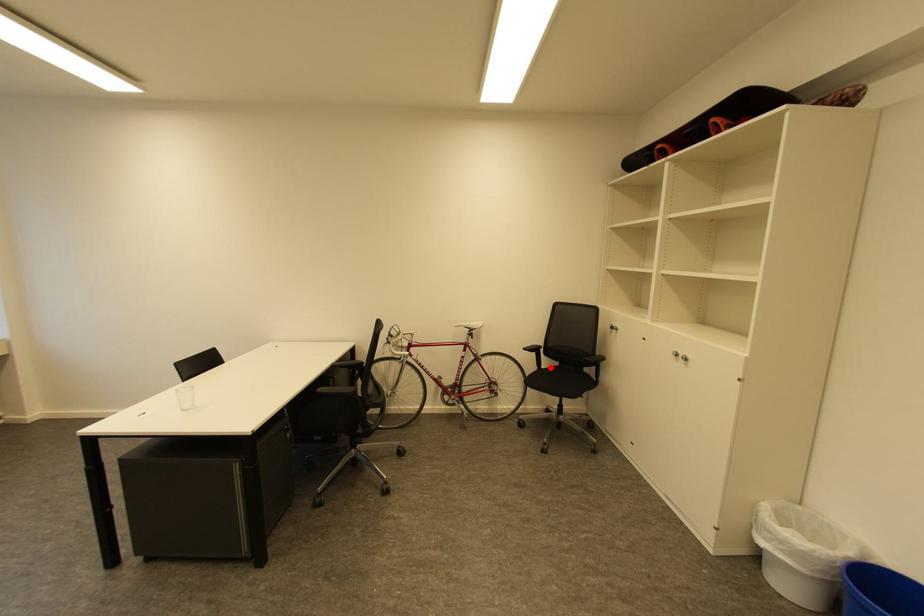
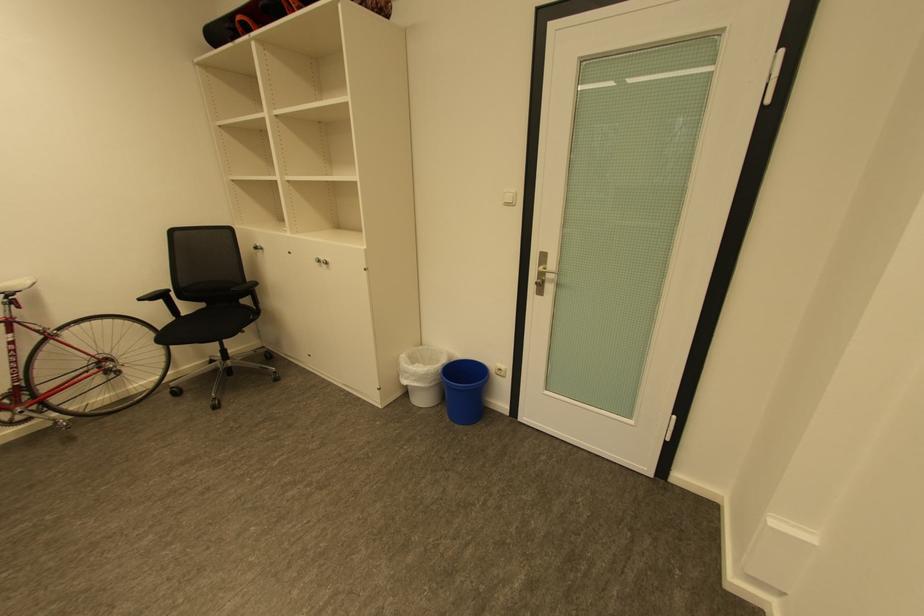
The point at the highlighted location is marked in the first image. Where is the corresponding point in the second image?

(190, 315)